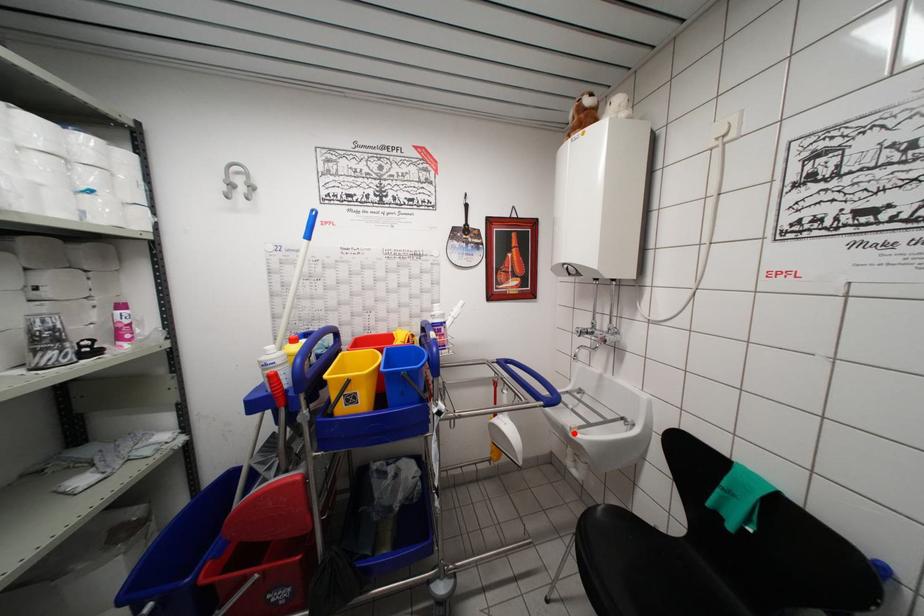
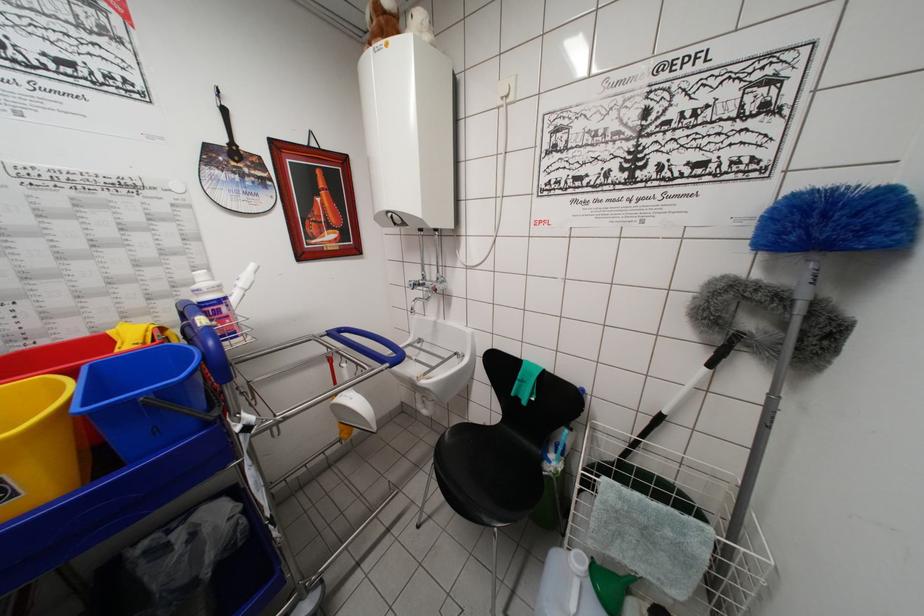
Question: I am providing you with two images of the same scene from different viewpoints. Given a red point in image1, look at the same physical point in image2. Is it:

Choices:
 (A) Closer to the viewpoint
 (B) Farther from the viewpoint

Answer: (A)